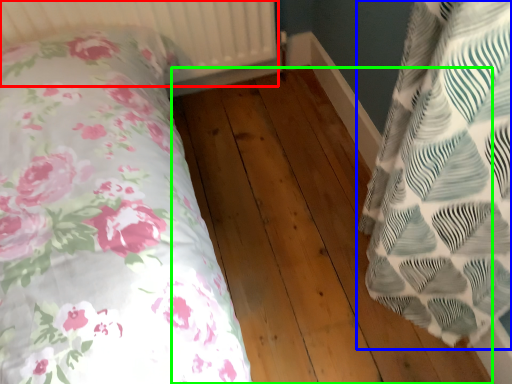
Question: Which object is the farthest from radiator (highlighted by a red box)? Choose among these: pillow (highlighted by a blue box) or hardwood (highlighted by a green box).

Choices:
 (A) pillow
 (B) hardwood

Answer: (A)